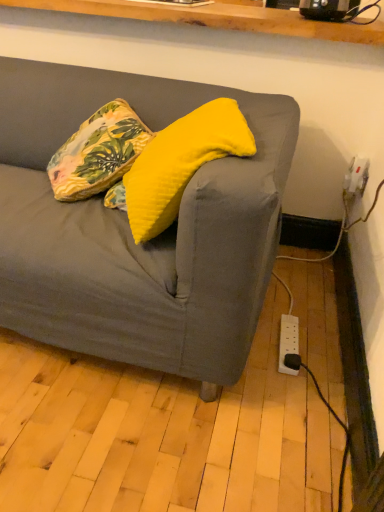
Question: Considering the relative sizes of yellow soft cushion at center, which is the first pillow in right-to-left order, and floral fabric pillow at upper left, the 2th pillow from the right, in the image provided, is yellow soft cushion at center, which is the first pillow in right-to-left order, bigger than floral fabric pillow at upper left, the 2th pillow from the right,?

Choices:
 (A) yes
 (B) no

Answer: (A)

Question: From a real-world perspective, is yellow soft cushion at center, which is the first pillow in right-to-left order, under floral fabric pillow at upper left, which is counted as the first pillow, starting from the left?

Choices:
 (A) no
 (B) yes

Answer: (A)

Question: From a real-world perspective, is yellow soft cushion at center, which appears as the second pillow when viewed from the left, on top of floral fabric pillow at upper left, which is counted as the first pillow, starting from the left?

Choices:
 (A) yes
 (B) no

Answer: (A)

Question: Considering the relative sizes of yellow soft cushion at center, which appears as the second pillow when viewed from the left, and floral fabric pillow at upper left, the 2th pillow from the right, in the image provided, is yellow soft cushion at center, which appears as the second pillow when viewed from the left, smaller than floral fabric pillow at upper left, the 2th pillow from the right,?

Choices:
 (A) yes
 (B) no

Answer: (B)

Question: Is yellow soft cushion at center, which appears as the second pillow when viewed from the left, positioned far away from floral fabric pillow at upper left, which is counted as the first pillow, starting from the left?

Choices:
 (A) no
 (B) yes

Answer: (A)

Question: Considering the relative sizes of yellow soft cushion at center, which is the first pillow in right-to-left order, and floral fabric pillow at upper left, which is counted as the first pillow, starting from the left, in the image provided, is yellow soft cushion at center, which is the first pillow in right-to-left order, wider than floral fabric pillow at upper left, which is counted as the first pillow, starting from the left,?

Choices:
 (A) no
 (B) yes

Answer: (A)

Question: Is floral fabric pillow at upper left, which is counted as the first pillow, starting from the left, wider than yellow soft cushion at center, which appears as the second pillow when viewed from the left?

Choices:
 (A) yes
 (B) no

Answer: (A)

Question: From a real-world perspective, is floral fabric pillow at upper left, the 2th pillow from the right, physically below yellow soft cushion at center, which is the first pillow in right-to-left order?

Choices:
 (A) no
 (B) yes

Answer: (B)

Question: Considering the relative positions of floral fabric pillow at upper left, the 2th pillow from the right, and yellow soft cushion at center, which is the first pillow in right-to-left order, in the image provided, is floral fabric pillow at upper left, the 2th pillow from the right, to the left of yellow soft cushion at center, which is the first pillow in right-to-left order, from the viewer's perspective?

Choices:
 (A) yes
 (B) no

Answer: (A)

Question: Is floral fabric pillow at upper left, the 2th pillow from the right, to the right of yellow soft cushion at center, which appears as the second pillow when viewed from the left, from the viewer's perspective?

Choices:
 (A) no
 (B) yes

Answer: (A)

Question: Is yellow soft cushion at center, which is the first pillow in right-to-left order, a part of floral fabric pillow at upper left, which is counted as the first pillow, starting from the left?

Choices:
 (A) yes
 (B) no

Answer: (B)

Question: From the image's perspective, is floral fabric pillow at upper left, which is counted as the first pillow, starting from the left, below yellow soft cushion at center, which appears as the second pillow when viewed from the left?

Choices:
 (A) yes
 (B) no

Answer: (B)

Question: Is point (112, 168) closer or farther from the camera than point (200, 157)?

Choices:
 (A) farther
 (B) closer

Answer: (A)